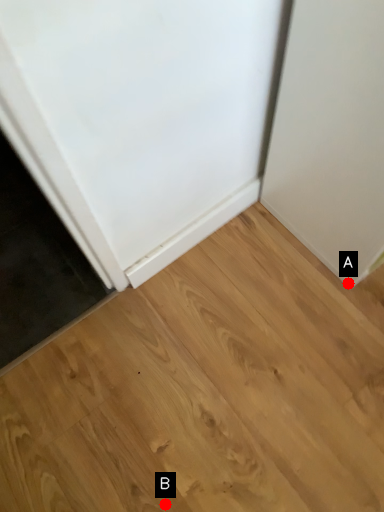
Question: Two points are circled on the image, labeled by A and B beside each circle. Which point is farther from the camera taking this photo?

Choices:
 (A) A is further
 (B) B is further

Answer: (A)